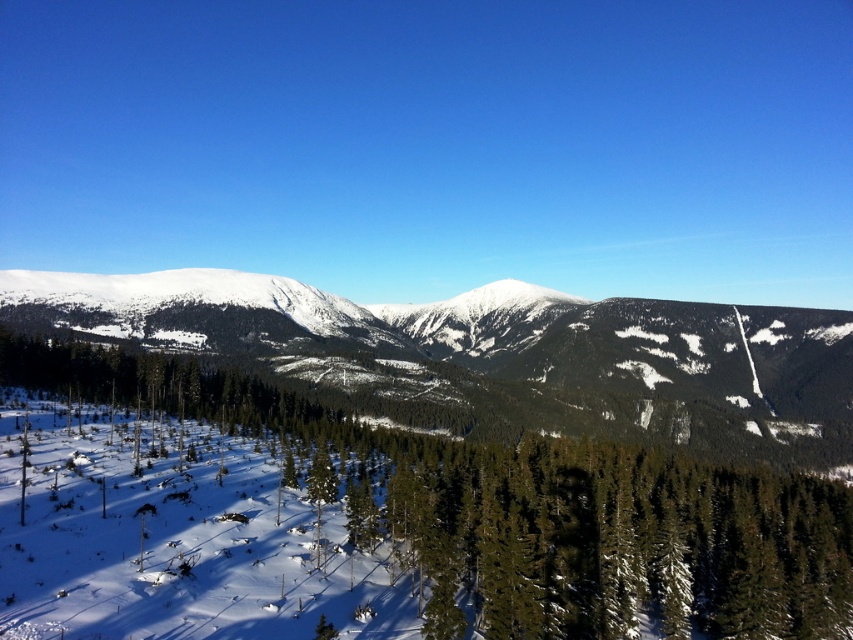
Question: Is green matte tree at lower left further to camera compared to snowy mountain at center?

Choices:
 (A) no
 (B) yes

Answer: (A)

Question: Which object is farther from the camera taking this photo?

Choices:
 (A) green matte tree at lower left
 (B) snowy mountain at center

Answer: (B)

Question: Is green matte tree at lower left bigger than snowy mountain at center?

Choices:
 (A) no
 (B) yes

Answer: (A)

Question: Does green matte tree at lower left have a lesser width compared to snowy mountain at center?

Choices:
 (A) no
 (B) yes

Answer: (B)

Question: Which of the following is the closest to the observer?

Choices:
 (A) green matte tree at lower left
 (B) snowy mountain at center

Answer: (A)